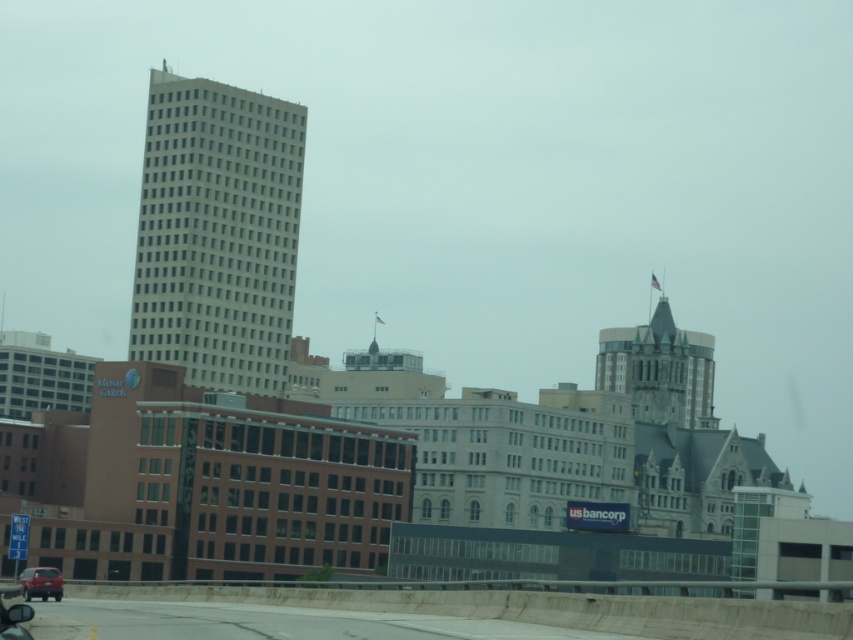
Question: Among these points, which one is farthest from the camera?

Choices:
 (A) pyautogui.click(x=57, y=577)
 (B) pyautogui.click(x=245, y=284)
 (C) pyautogui.click(x=665, y=314)

Answer: (C)

Question: In this image, where is white smooth building at center located relative to matte red car at lower left?

Choices:
 (A) right
 (B) left

Answer: (B)

Question: Is white smooth building at center above green copper spire at upper right?

Choices:
 (A) no
 (B) yes

Answer: (B)

Question: Which of the following is the farthest from the observer?

Choices:
 (A) green copper spire at upper right
 (B) white smooth building at center
 (C) matte red car at lower left

Answer: (A)

Question: Which object is farther from the camera taking this photo?

Choices:
 (A) matte red car at lower left
 (B) white smooth building at center

Answer: (B)

Question: Can you confirm if green copper spire at upper right is smaller than matte red car at lower left?

Choices:
 (A) no
 (B) yes

Answer: (A)